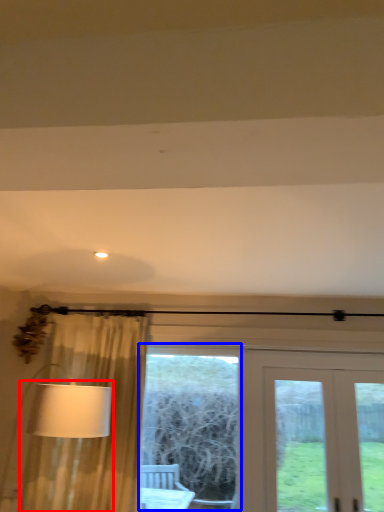
Question: Among these objects, which one is nearest to the camera, table lamp (highlighted by a red box) or bay window (highlighted by a blue box)?

Choices:
 (A) table lamp
 (B) bay window

Answer: (A)